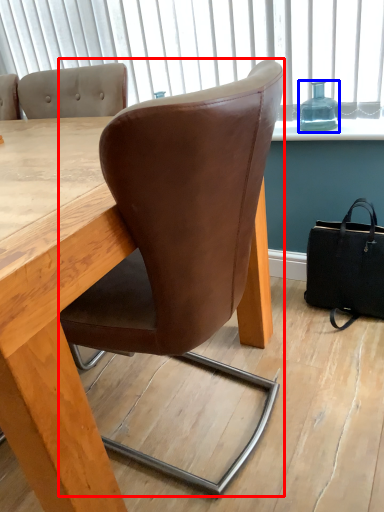
Question: Which object appears closest to the camera in this image, chair (highlighted by a red box) or bottle (highlighted by a blue box)?

Choices:
 (A) chair
 (B) bottle

Answer: (A)